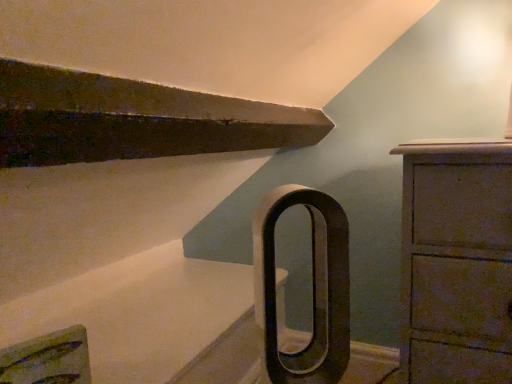
Question: Is black matte door handle at center oriented towards wooden chest of drawers at right?

Choices:
 (A) yes
 (B) no

Answer: (B)

Question: Is black matte door handle at center thinner than wooden chest of drawers at right?

Choices:
 (A) yes
 (B) no

Answer: (A)

Question: From the image's perspective, is black matte door handle at center on wooden chest of drawers at right?

Choices:
 (A) yes
 (B) no

Answer: (A)

Question: Is black matte door handle at center positioned in front of wooden chest of drawers at right?

Choices:
 (A) no
 (B) yes

Answer: (B)

Question: Does black matte door handle at center lie behind wooden chest of drawers at right?

Choices:
 (A) yes
 (B) no

Answer: (B)

Question: Can wooden chest of drawers at right be found inside black matte door handle at center?

Choices:
 (A) yes
 (B) no

Answer: (B)

Question: Is wooden chest of drawers at right next to black matte door handle at center and touching it?

Choices:
 (A) yes
 (B) no

Answer: (B)

Question: Is wooden chest of drawers at right oriented away from black matte door handle at center?

Choices:
 (A) no
 (B) yes

Answer: (A)

Question: From the image's perspective, is wooden chest of drawers at right under black matte door handle at center?

Choices:
 (A) yes
 (B) no

Answer: (A)

Question: Is black matte door handle at center located within wooden chest of drawers at right?

Choices:
 (A) no
 (B) yes

Answer: (A)

Question: Is the depth of wooden chest of drawers at right less than that of black matte door handle at center?

Choices:
 (A) no
 (B) yes

Answer: (A)

Question: Can you confirm if wooden chest of drawers at right is positioned to the left of black matte door handle at center?

Choices:
 (A) no
 (B) yes

Answer: (A)

Question: Based on their positions, is wooden chest of drawers at right located to the left or right of black matte door handle at center?

Choices:
 (A) right
 (B) left

Answer: (A)